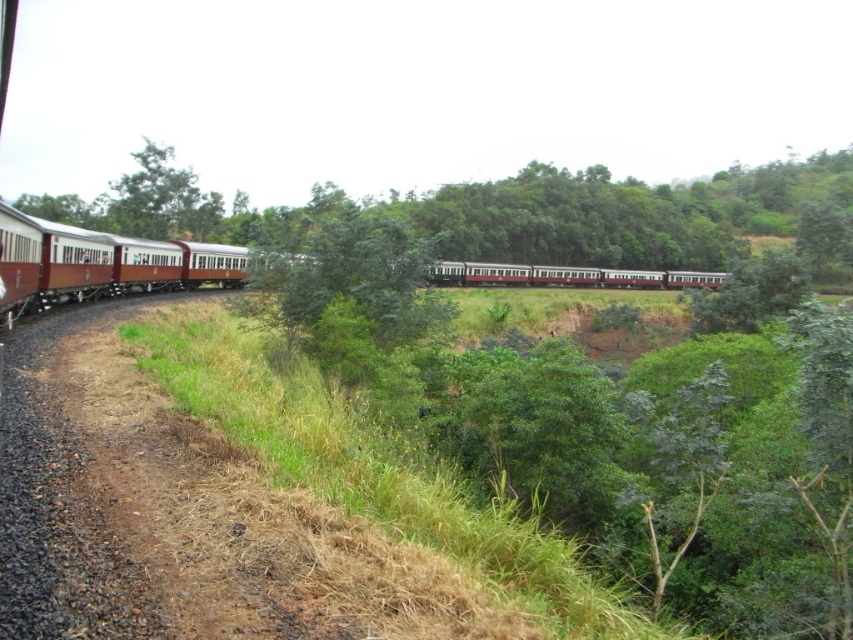
Question: Can you confirm if matte red train at center is positioned above green leafy tree at upper left?

Choices:
 (A) no
 (B) yes

Answer: (A)

Question: Observing the image, what is the correct spatial positioning of matte red train at center in reference to green leafy tree at upper left?

Choices:
 (A) right
 (B) left

Answer: (A)

Question: Which point is closer to the camera?

Choices:
 (A) (132, 209)
 (B) (692, 285)

Answer: (A)

Question: Among these points, which one is farthest from the camera?

Choices:
 (A) (283, 269)
 (B) (190, 232)

Answer: (B)

Question: Is matte red train at center positioned before green leafy tree at upper left?

Choices:
 (A) no
 (B) yes

Answer: (B)